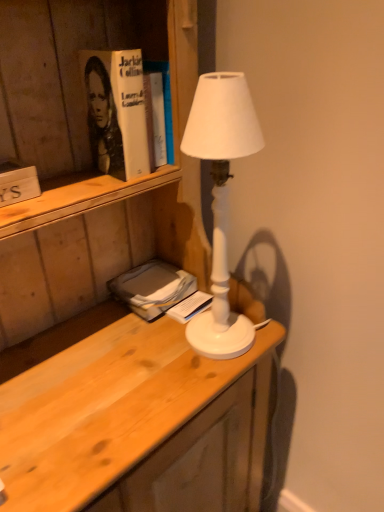
Question: Considering the relative sizes of white paper book at center, which is counted as the first book, starting from the bottom, and white matte lamp at center in the image provided, is white paper book at center, which is counted as the first book, starting from the bottom, bigger than white matte lamp at center?

Choices:
 (A) yes
 (B) no

Answer: (B)

Question: Is white paper book at center, which is the third book from top to bottom, thinner than white matte lamp at center?

Choices:
 (A) no
 (B) yes

Answer: (B)

Question: From a real-world perspective, is white paper book at center, which is the third book from top to bottom, positioned over white matte lamp at center based on gravity?

Choices:
 (A) no
 (B) yes

Answer: (A)

Question: Would you say white paper book at center, marked as the 1th book in a right-to-left arrangement, is outside white matte lamp at center?

Choices:
 (A) no
 (B) yes

Answer: (B)

Question: Is white paper book at center, which is counted as the first book, starting from the back, surrounding white matte lamp at center?

Choices:
 (A) no
 (B) yes

Answer: (A)

Question: Based on their sizes in the image, would you say white paper book at center, which is counted as the first book, starting from the bottom, is bigger or smaller than wooden sign at left, marked as the 1th book in a top-to-bottom arrangement?

Choices:
 (A) small
 (B) big

Answer: (A)

Question: Considering their positions, is white paper book at center, which is the third book from top to bottom, located in front of or behind wooden sign at left, the third book when ordered from right to left?

Choices:
 (A) behind
 (B) front

Answer: (A)

Question: Would you say white paper book at center, marked as the 1th book in a right-to-left arrangement, is to the left or to the right of wooden sign at left, the third book in the bottom-to-top sequence, in the picture?

Choices:
 (A) right
 (B) left

Answer: (A)

Question: From a real-world perspective, relative to wooden sign at left, the third book in the bottom-to-top sequence, is white paper book at center, which is the third book from left to right, vertically above or below?

Choices:
 (A) below
 (B) above

Answer: (A)

Question: Is hardcover book at upper left bigger or smaller than white paper book at center, positioned as the third book in front-to-back order?

Choices:
 (A) small
 (B) big

Answer: (B)

Question: In the image, is hardcover book at upper left positioned in front of or behind white paper book at center, which is the third book from left to right?

Choices:
 (A) behind
 (B) front

Answer: (B)

Question: From a real-world perspective, relative to white paper book at center, marked as the 1th book in a right-to-left arrangement, is hardcover book at upper left vertically above or below?

Choices:
 (A) above
 (B) below

Answer: (A)

Question: Choose the correct answer: Is hardcover book at upper left inside white paper book at center, which is the third book from top to bottom, or outside it?

Choices:
 (A) inside
 (B) outside

Answer: (B)

Question: Is gray matte book at lower left, acting as the second book starting from the top, spatially inside wooden sign at left, which ranks as the 1th book in front-to-back order, or outside of it?

Choices:
 (A) outside
 (B) inside

Answer: (A)

Question: Looking at their shapes, would you say gray matte book at lower left, the 2th book when ordered from bottom to top, is wider or thinner than wooden sign at left, which ranks as the 1th book in front-to-back order?

Choices:
 (A) thin
 (B) wide

Answer: (B)